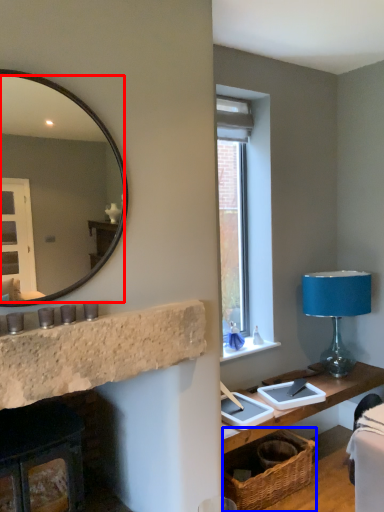
Question: Among these objects, which one is nearest to the camera, mirror (highlighted by a red box) or basket (highlighted by a blue box)?

Choices:
 (A) mirror
 (B) basket

Answer: (A)